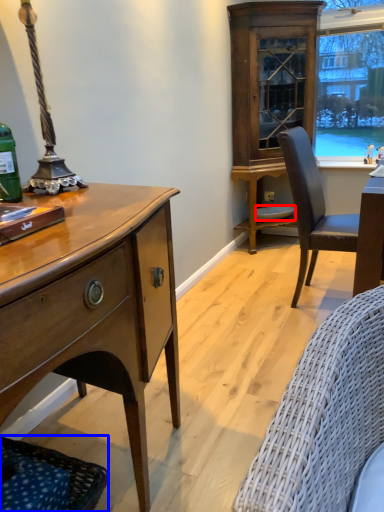
Question: Which object is further to the camera taking this photo, plate (highlighted by a red box) or studio couch (highlighted by a blue box)?

Choices:
 (A) plate
 (B) studio couch

Answer: (A)